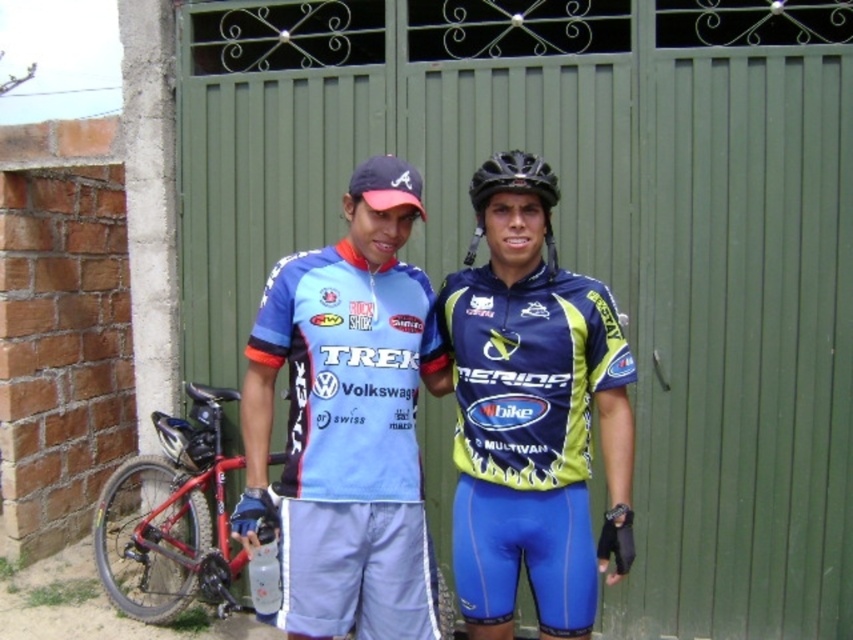
You are a photographer standing at the entrance of the residential structure with a green metal gate and a brick wall on the left. You want to take a photo of the matte blue jersey at center. Where should you position yourself to capture the jersey in the frame?

The matte blue jersey at center is located at coordinates point [350,442], so you should position yourself facing the center of the gate area to capture it in the frame.